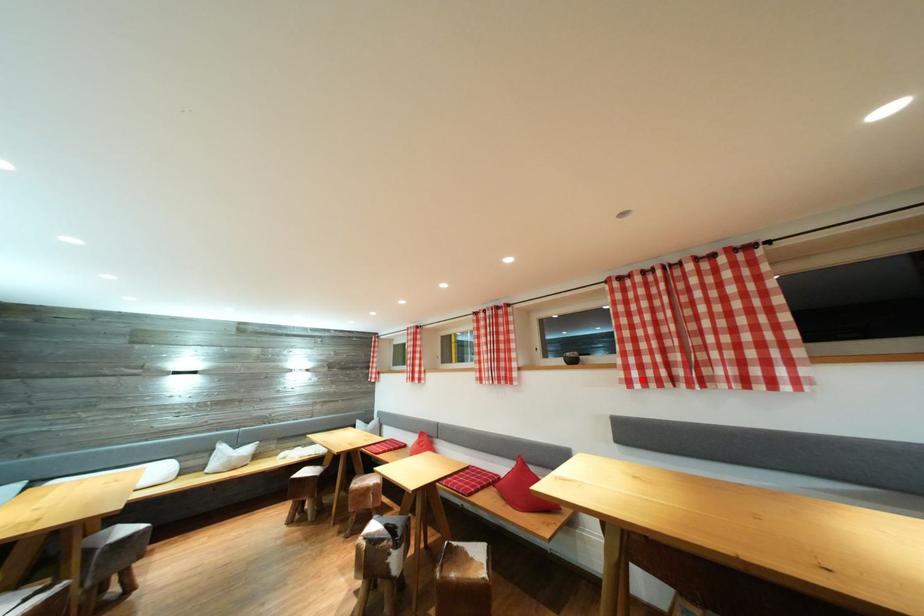
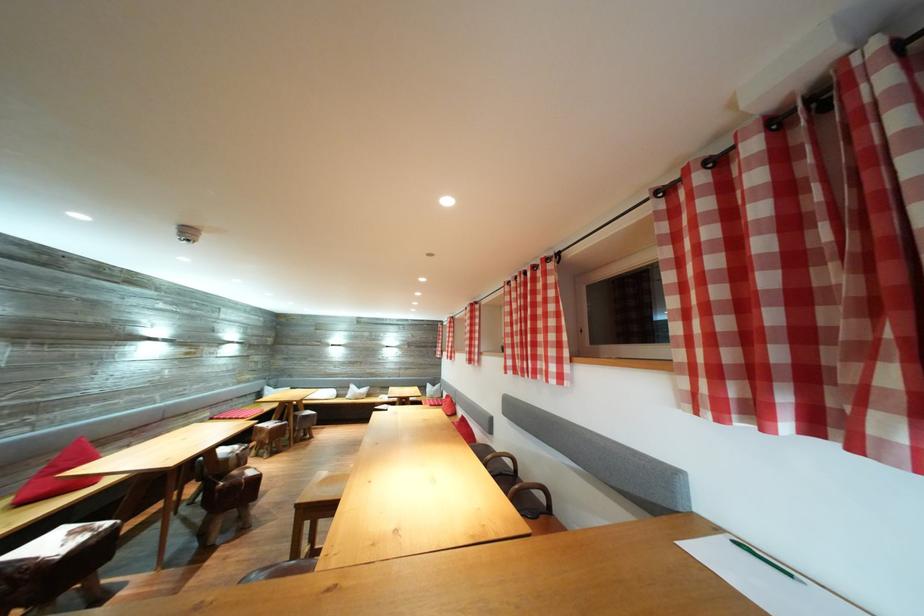
Find the pixel in the second image that matches the highlighted location in the first image.

(517, 368)